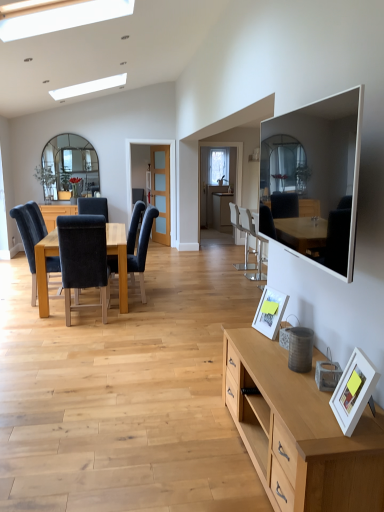
Question: Is velvet black chair at left, marked as the 4th chair in a right-to-left arrangement, not close to metallic silver bar stool at center, which ranks as the fifth chair in left-to-right order?

Choices:
 (A) yes
 (B) no

Answer: (A)

Question: Is velvet black chair at left, acting as the 1th chair starting from the front, positioned beyond the bounds of metallic silver bar stool at center, which ranks as the fifth chair in left-to-right order?

Choices:
 (A) no
 (B) yes

Answer: (B)

Question: Considering the relative sizes of velvet black chair at left, marked as the 4th chair in a right-to-left arrangement, and metallic silver bar stool at center, the 3th chair in the front-to-back sequence, in the image provided, is velvet black chair at left, marked as the 4th chair in a right-to-left arrangement, wider than metallic silver bar stool at center, the 3th chair in the front-to-back sequence,?

Choices:
 (A) yes
 (B) no

Answer: (A)

Question: Is velvet black chair at left, which is the second chair in left-to-right order, in front of metallic silver bar stool at center, the 1th chair viewed from the right?

Choices:
 (A) no
 (B) yes

Answer: (B)

Question: From the image's perspective, is velvet black chair at left, which is the second chair in left-to-right order, beneath metallic silver bar stool at center, which ranks as the fifth chair in left-to-right order?

Choices:
 (A) no
 (B) yes

Answer: (B)

Question: Is velvet black chair at left, marked as the 4th chair in a right-to-left arrangement, taller or shorter than clear glass door at center?

Choices:
 (A) tall
 (B) short

Answer: (B)

Question: Is velvet black chair at left, which is the second chair in left-to-right order, to the left or to the right of clear glass door at center in the image?

Choices:
 (A) left
 (B) right

Answer: (A)

Question: Is point (69, 283) positioned closer to the camera than point (168, 237)?

Choices:
 (A) farther
 (B) closer

Answer: (B)

Question: Is velvet black chair at left, acting as the 1th chair starting from the front, in front of or behind clear glass door at center in the image?

Choices:
 (A) behind
 (B) front

Answer: (B)

Question: From their relative heights in the image, would you say white plastic chair at center, the fourth chair from the left, is taller or shorter than clear glass door at center?

Choices:
 (A) short
 (B) tall

Answer: (A)

Question: In terms of size, does white plastic chair at center, which is the 1th chair from back to front, appear bigger or smaller than clear glass door at center?

Choices:
 (A) big
 (B) small

Answer: (A)

Question: Visually, is white plastic chair at center, which is the 1th chair from back to front, positioned to the left or to the right of clear glass door at center?

Choices:
 (A) right
 (B) left

Answer: (A)

Question: Do you think white plastic chair at center, which is the 1th chair from back to front, is within clear glass door at center, or outside of it?

Choices:
 (A) inside
 (B) outside

Answer: (B)

Question: Is velvet black chair at left, which is counted as the 5th chair, starting from the back, spatially inside white matte picture frame at lower right, acting as the 2th picture frame starting from the left, or outside of it?

Choices:
 (A) outside
 (B) inside

Answer: (A)

Question: From the image's perspective, is velvet black chair at left, which is counted as the 5th chair, starting from the back, above or below white matte picture frame at lower right, acting as the 2th picture frame starting from the left?

Choices:
 (A) above
 (B) below

Answer: (A)